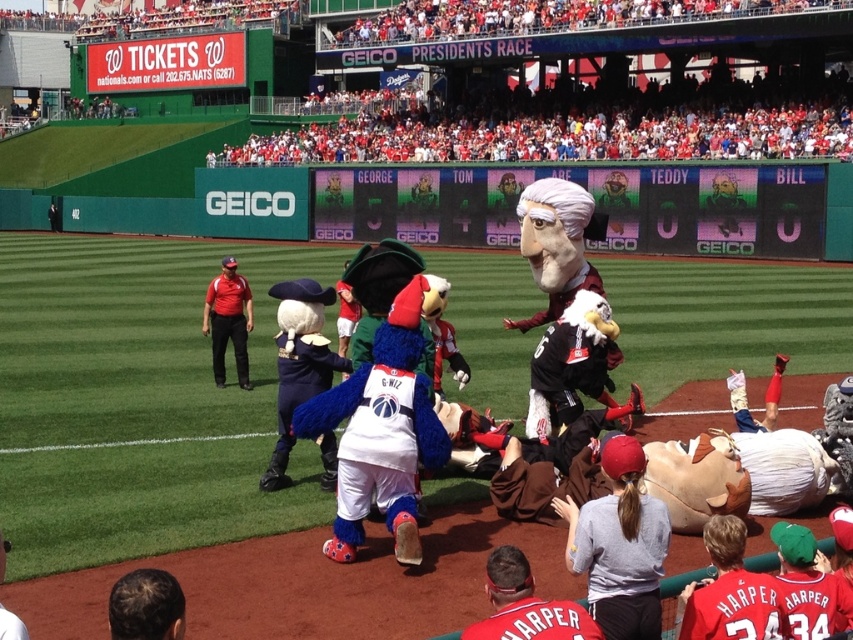
Question: Considering the real-world distances, which object is closest to the red fabric crowd at upper center?

Choices:
 (A) red jersey at lower right
 (B) dark brown hair at lower left

Answer: (A)

Question: Considering the relative positions of red fabric cap at lower center and red shirt at center in the image provided, where is red fabric cap at lower center located with respect to red shirt at center?

Choices:
 (A) right
 (B) left

Answer: (A)

Question: In this image, where is red fabric crowd at upper center located relative to blue plush mascot at center?

Choices:
 (A) below
 (B) above

Answer: (B)

Question: Which object appears farthest from the camera in this image?

Choices:
 (A) red shirt at center
 (B) red fabric crowd at upper center
 (C) dark brown hair at lower left
 (D) gray cotton shirt at lower center

Answer: (B)

Question: Which point is farther to the camera?

Choices:
 (A) (369, 429)
 (B) (514, 129)
 (C) (231, 257)
 (D) (585, 518)

Answer: (B)

Question: Considering the relative positions of red jersey at lower right and dark brown hair at lower left in the image provided, where is red jersey at lower right located with respect to dark brown hair at lower left?

Choices:
 (A) right
 (B) left

Answer: (A)